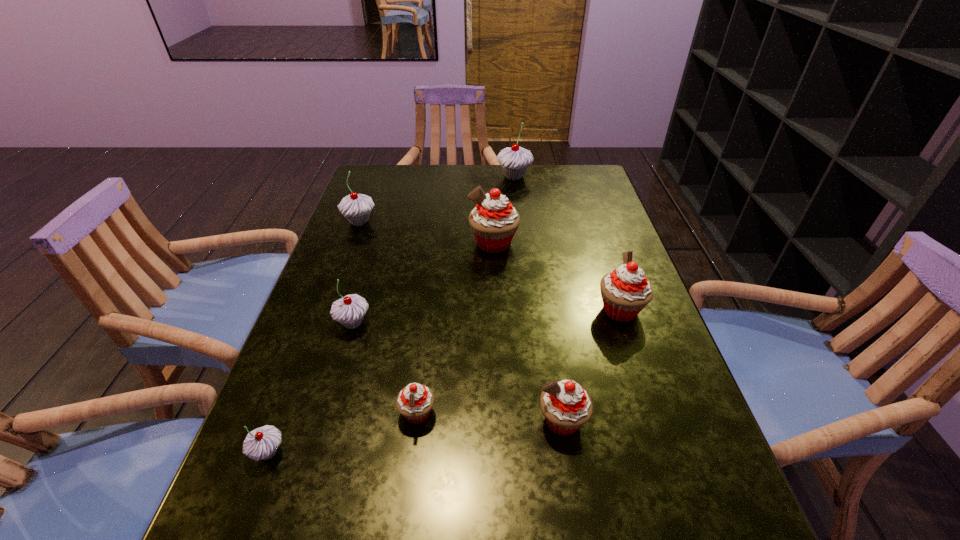
This screenshot has height=540, width=960. I want to click on the fourth cupcake from left to right, so click(415, 401).

Locate an element on the screen. vacant space situated on the left of the farthest object is located at coordinates (405, 176).

Identify the location of free location located on the front of the farthest pink cupcake. The image size is (960, 540). (497, 349).

You are a GUI agent. You are given a task and a screenshot of the screen. Output one action in this format:
    pyautogui.click(x=<x>, y=<y>)
    Task: Click on the free space located on the front of the third nearest gray cupcake
    
    Given the screenshot: What is the action you would take?
    [317, 336]

Locate an element on the screen. vacant space situated on the front of the third nearest pink cupcake is located at coordinates (656, 415).

Find the location of a particular element. The width and height of the screenshot is (960, 540). vacant space located 0.060m on the back of the second nearest gray cupcake is located at coordinates (362, 292).

Identify the location of vacant space located on the left of the second smallest pink cupcake. (318, 421).

You are a GUI agent. You are given a task and a screenshot of the screen. Output one action in this format:
    pyautogui.click(x=<x>, y=<y>)
    Task: Click on the vacant space located on the right of the nearest gray cupcake
    This screenshot has height=540, width=960.
    Given the screenshot: What is the action you would take?
    pyautogui.click(x=471, y=452)

Locate an element on the screen. Image resolution: width=960 pixels, height=540 pixels. vacant area situated on the left of the smallest pink cupcake is located at coordinates (316, 413).

This screenshot has height=540, width=960. In order to click on object that is at the far edge in this screenshot , I will do `click(515, 160)`.